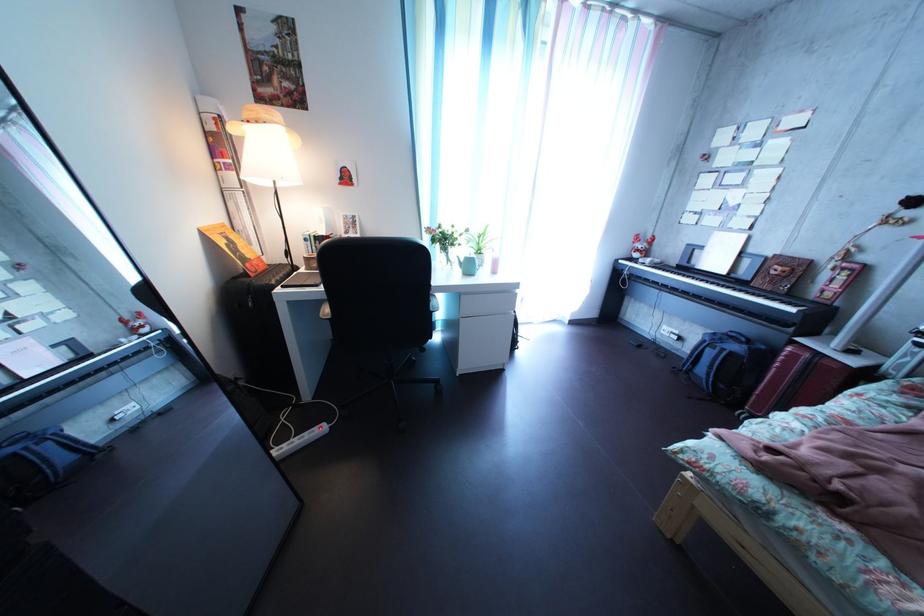
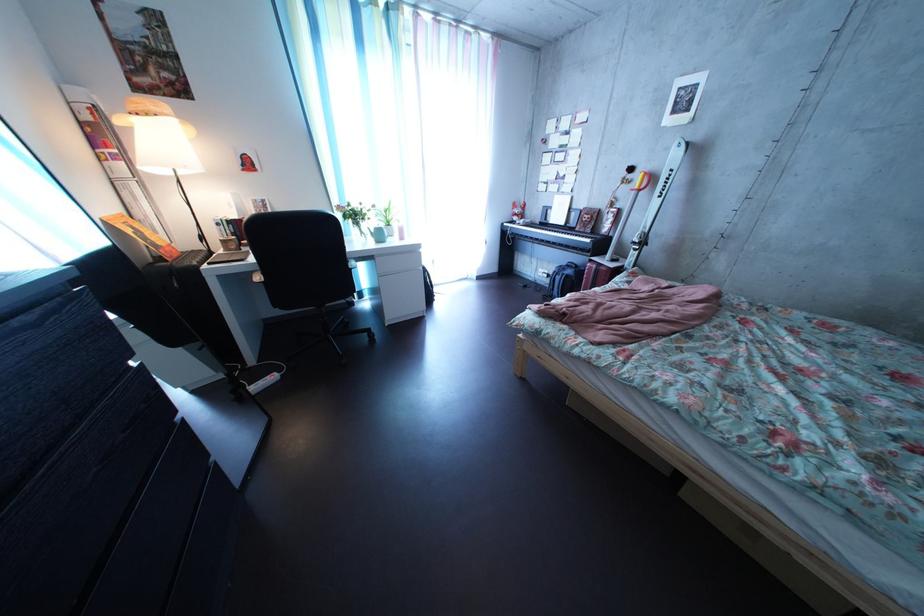
Locate, in the second image, the point that corresponds to the point at 737,281 in the first image.

(577, 232)